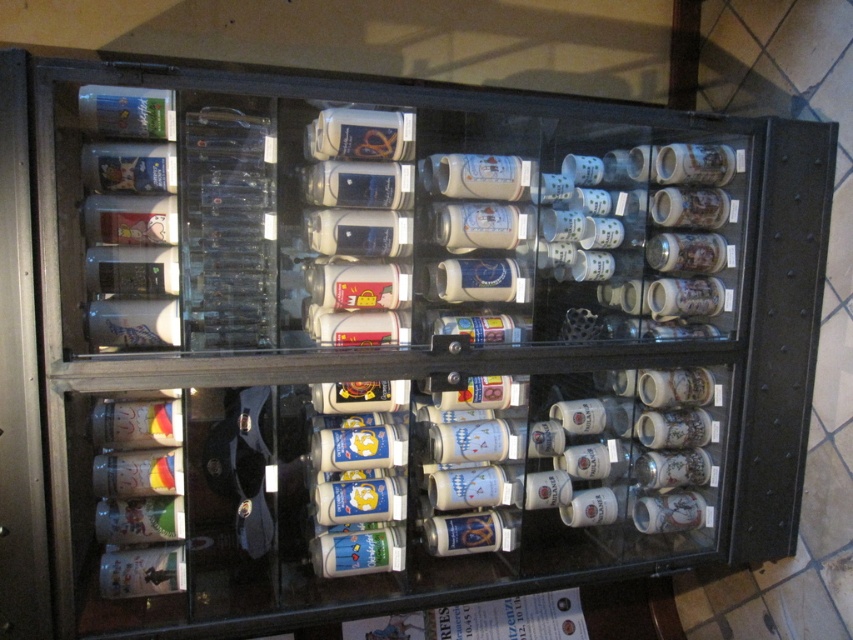
Consider the image. Is translucent glass bottle at upper left smaller than matte glass bottle at center?

Yes, translucent glass bottle at upper left is smaller than matte glass bottle at center.

Based on the photo, who is shorter, translucent glass bottle at upper left or matte glass bottle at center?

translucent glass bottle at upper left

Which is behind, point (115, 108) or point (320, 544)?

The point (320, 544) is behind.

You are a GUI agent. You are given a task and a screenshot of the screen. Output one action in this format:
    pyautogui.click(x=<x>, y=<y>)
    Task: Click on the translucent glass bottle at upper left
    The image size is (853, 640).
    Given the screenshot: What is the action you would take?
    pyautogui.click(x=126, y=112)

Is point (113, 120) farther from viewer compared to point (132, 186)?

That is False.

Is translucent glass bottle at upper left bigger than matte plastic bottle at upper left?

Incorrect, translucent glass bottle at upper left is not larger than matte plastic bottle at upper left.

Which is behind, point (122, 100) or point (90, 164)?

Positioned behind is point (90, 164).

Locate an element on the screen. Image resolution: width=853 pixels, height=640 pixels. translucent glass bottle at upper left is located at coordinates (126, 112).

Is white glossy mug at center closer to camera compared to matte glass bottle at center?

That is True.

Is point (517, 193) positioned after point (383, 566)?

That is False.

Where is `white glossy mug at center`? white glossy mug at center is located at coordinates (479, 176).